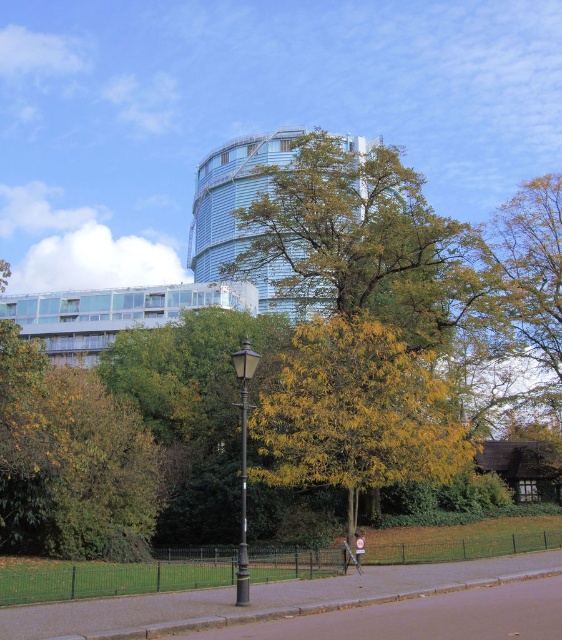
Question: Is paved concrete sidewalk at center below polished brass lamp post at center?

Choices:
 (A) no
 (B) yes

Answer: (B)

Question: Based on their relative distances, which object is nearer to the polished brass lamp post at center?

Choices:
 (A) metallic signpost at center
 (B) paved concrete sidewalk at center

Answer: (B)

Question: From the image, what is the correct spatial relationship of yellow-green leaves at center in relation to metallic signpost at center?

Choices:
 (A) below
 (B) above

Answer: (B)

Question: Which object is the farthest from the metallic signpost at center?

Choices:
 (A) polished brass lamp post at center
 (B) yellow-green leaves at center
 (C) paved concrete sidewalk at center

Answer: (A)

Question: Which of the following is the closest to the observer?

Choices:
 (A) (244, 444)
 (B) (360, 548)

Answer: (A)

Question: Can you confirm if polished brass lamp post at center is positioned to the right of metallic signpost at center?

Choices:
 (A) yes
 (B) no

Answer: (B)